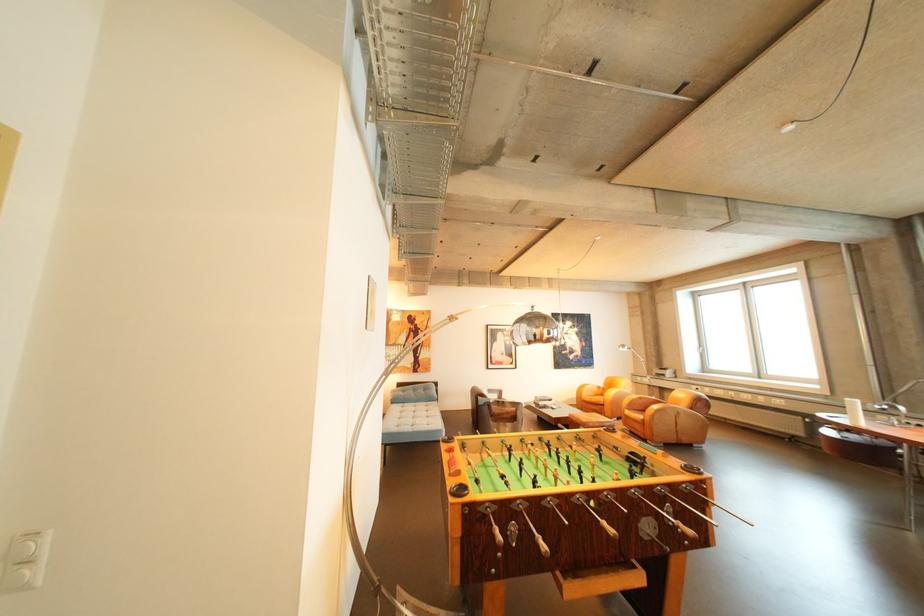
What do you see at coordinates (25, 594) in the screenshot? The width and height of the screenshot is (924, 616). I see `the white light switch` at bounding box center [25, 594].